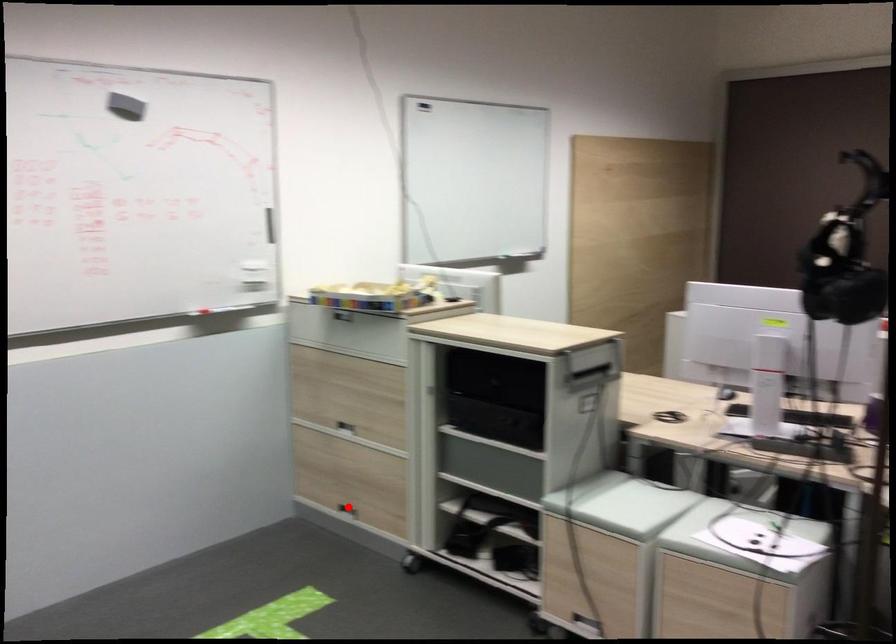
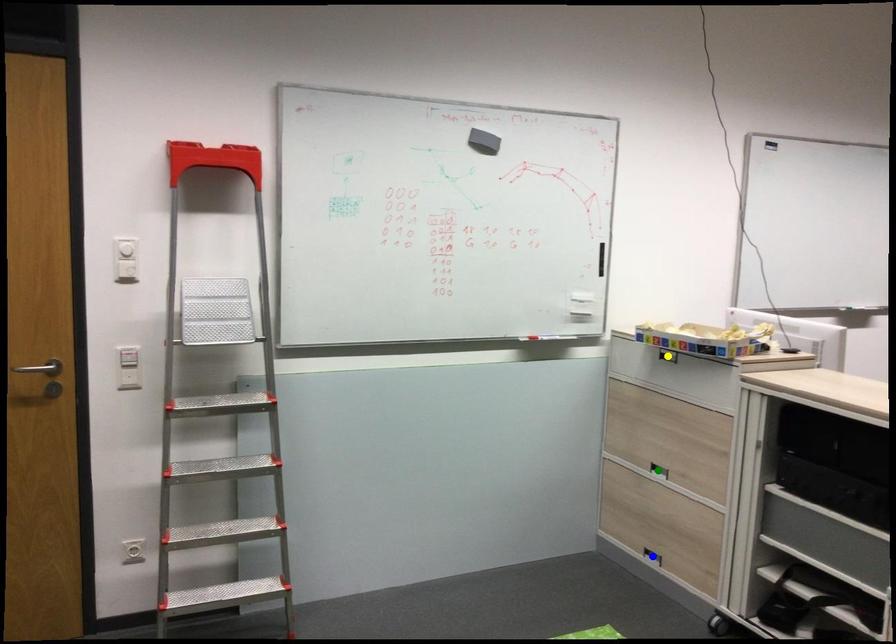
Question: I am providing you with two images of the same scene from different viewpoints. A red point is marked on the first image. You are given multiple points on the second image. Can you choose the point in image 2 that corresponds to the point in image 1?

Choices:
 (A) blue point
 (B) green point
 (C) yellow point

Answer: (A)